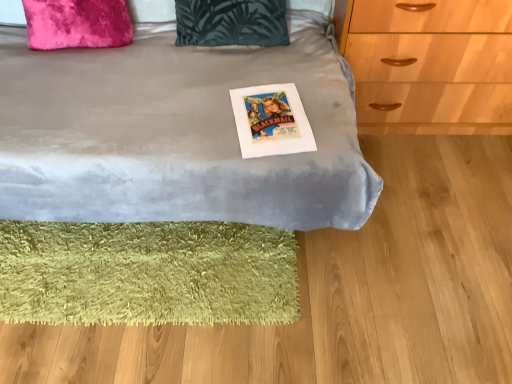
Question: Considering the relative positions of velvet gray bed at center and green shaggy rug at lower left in the image provided, is velvet gray bed at center to the right of green shaggy rug at lower left from the viewer's perspective?

Choices:
 (A) no
 (B) yes

Answer: (A)

Question: Is velvet gray bed at center thinner than green shaggy rug at lower left?

Choices:
 (A) no
 (B) yes

Answer: (A)

Question: Can you see velvet gray bed at center touching green shaggy rug at lower left?

Choices:
 (A) yes
 (B) no

Answer: (B)

Question: Is velvet gray bed at center not near green shaggy rug at lower left?

Choices:
 (A) yes
 (B) no

Answer: (B)

Question: Is velvet gray bed at center to the left of green shaggy rug at lower left from the viewer's perspective?

Choices:
 (A) no
 (B) yes

Answer: (B)

Question: Is green shaggy rug at lower left a part of velvet gray bed at center?

Choices:
 (A) yes
 (B) no

Answer: (B)

Question: Is velvet gray bed at center smaller than dark green fabric pillow at upper center, placed as the second pillow when sorted from left to right?

Choices:
 (A) yes
 (B) no

Answer: (B)

Question: Does velvet gray bed at center come behind dark green fabric pillow at upper center, placed as the second pillow when sorted from left to right?

Choices:
 (A) yes
 (B) no

Answer: (B)

Question: Is dark green fabric pillow at upper center, which is the 1th pillow in right-to-left order, located within velvet gray bed at center?

Choices:
 (A) no
 (B) yes

Answer: (B)

Question: Are velvet gray bed at center and dark green fabric pillow at upper center, which is the 1th pillow in right-to-left order, located far from each other?

Choices:
 (A) no
 (B) yes

Answer: (A)

Question: Is velvet gray bed at center not within dark green fabric pillow at upper center, placed as the second pillow when sorted from left to right?

Choices:
 (A) no
 (B) yes

Answer: (B)

Question: Is velvet gray bed at center oriented towards dark green fabric pillow at upper center, which is the 1th pillow in right-to-left order?

Choices:
 (A) yes
 (B) no

Answer: (A)

Question: Considering the relative positions of dark green fabric pillow at upper center, placed as the second pillow when sorted from left to right, and white paper poster at center in the image provided, is dark green fabric pillow at upper center, placed as the second pillow when sorted from left to right, to the left of white paper poster at center from the viewer's perspective?

Choices:
 (A) no
 (B) yes

Answer: (B)